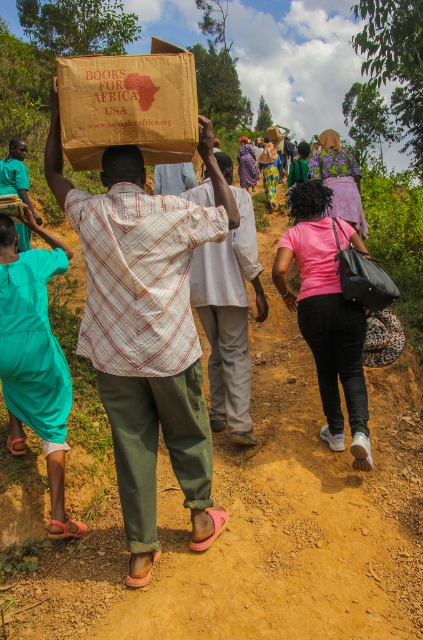
Based on the photo, based on the scene description, where is the smooth brown hair at upper center located in terms of its 2D coordinates?

The smooth brown hair at upper center is located at the 2D coordinates of point (8, 240).

You are observing the man in the image who is carrying a box. Which part of his head has the smooth brown hair at upper center located relative to the smooth brown hair at center?

The smooth brown hair at upper center is located below the smooth brown hair at center.